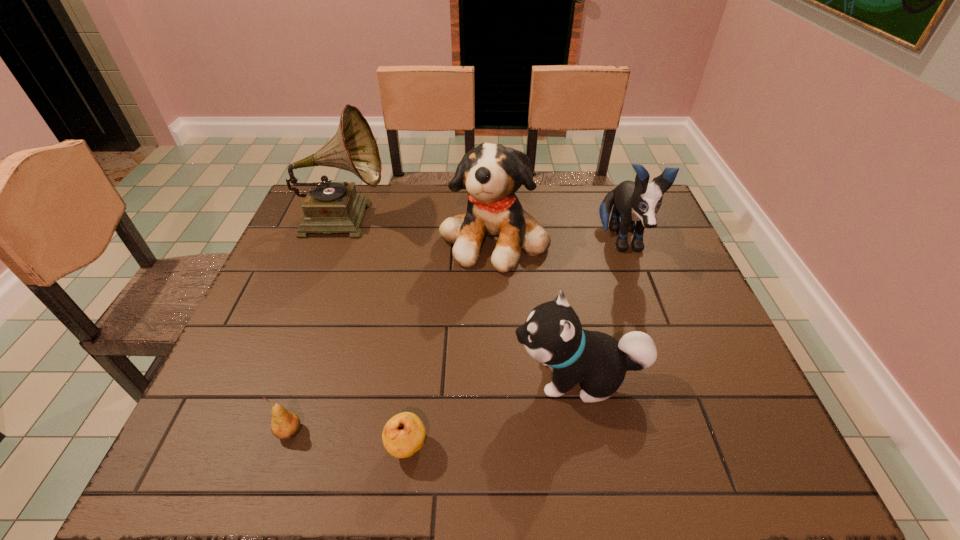
Find the location of `record player`. record player is located at coordinates (329, 207).

You are a GUI agent. You are given a task and a screenshot of the screen. Output one action in this format:
    pyautogui.click(x=<x>, y=<y>)
    Task: Click on the third nearest object
    The height and width of the screenshot is (540, 960).
    Given the screenshot: What is the action you would take?
    pyautogui.click(x=552, y=335)

The image size is (960, 540). Find the location of `the shortest puppy`. the shortest puppy is located at coordinates pos(552,335).

Where is `the left pear`? The width and height of the screenshot is (960, 540). the left pear is located at coordinates (284, 425).

Identify the location of the right pear. (404, 434).

Find the location of a particular element. Image resolution: width=960 pixels, height=540 pixels. free location located from the horn of the record player is located at coordinates (487, 217).

This screenshot has height=540, width=960. In order to click on vacant space located at the face of the third nearest object in this screenshot , I will do tap(489, 376).

At what (x,y) coordinates should I click in order to perform the action: click on free point located 0.250m at the face of the third nearest object. Please return your answer as a coordinate pair (x, y). The width and height of the screenshot is (960, 540). Looking at the image, I should click on (396, 376).

The image size is (960, 540). Identify the location of free space located at the face of the third nearest object. (350, 376).

The width and height of the screenshot is (960, 540). What are the coordinates of `free space located 0.390m on the right of the left pear` in the screenshot? It's located at (501, 431).